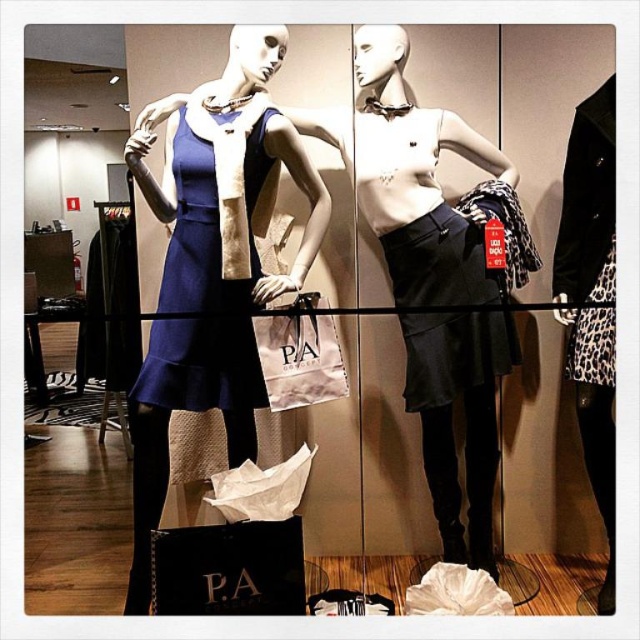
Question: Can you confirm if matte blue fabric dress at center is thinner than matte white paper bag at center?

Choices:
 (A) yes
 (B) no

Answer: (B)

Question: Does black leather skirt at center appear on the left side of matte white paper bag at center?

Choices:
 (A) yes
 (B) no

Answer: (B)

Question: Which of these objects is positioned closest to the matte black skirt at center?

Choices:
 (A) black leather skirt at center
 (B) matte white paper bag at center
 (C) matte blue fabric dress at center

Answer: (A)

Question: Where is matte black skirt at center located in relation to black leather skirt at center in the image?

Choices:
 (A) left
 (B) right

Answer: (B)

Question: Which of the following is the farthest from the observer?

Choices:
 (A) matte white paper bag at center
 (B) black leather skirt at center
 (C) matte blue dress at center
 (D) matte blue fabric dress at center

Answer: (B)

Question: Estimate the real-world distances between objects in this image. Which object is closer to the matte blue dress at center?

Choices:
 (A) matte white paper bag at center
 (B) matte black skirt at center

Answer: (A)